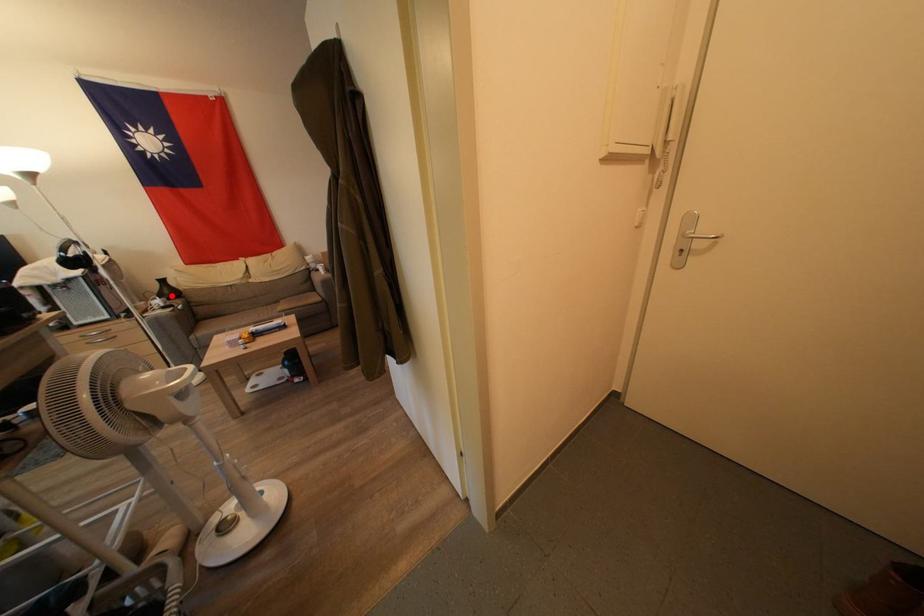
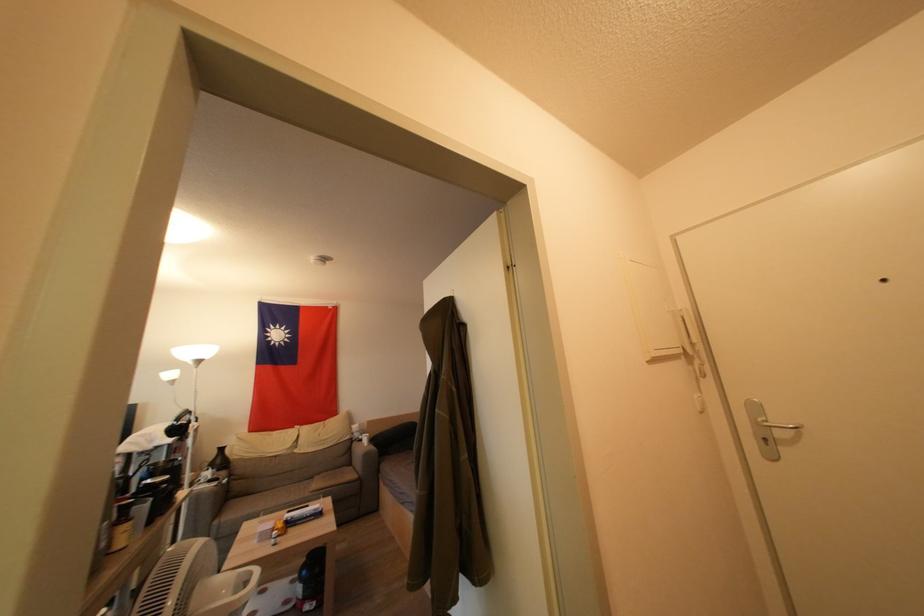
In the second image, find the point that corresponds to the highlighted location in the first image.

(224, 464)